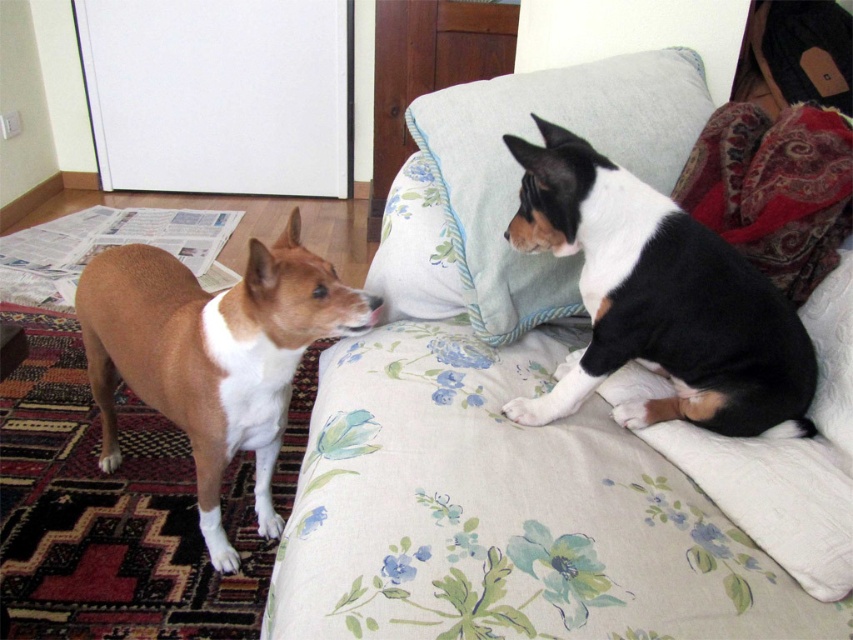
You are a cat trying to jump onto the fluffy fabric pillow at upper center. There is a floral fabric couch at upper center in the way. Can you jump over it to reach the pillow?

The floral fabric couch at upper center is closer to the viewer than the fluffy fabric pillow at upper center, so you can jump over the floral fabric couch at upper center to reach the pillow.

You are standing in the room and want to place a small plant pot exactly at point (521,426). What object will the plant pot be placed on?

The plant pot will be placed on the floral fabric couch at upper center located at point (521,426).